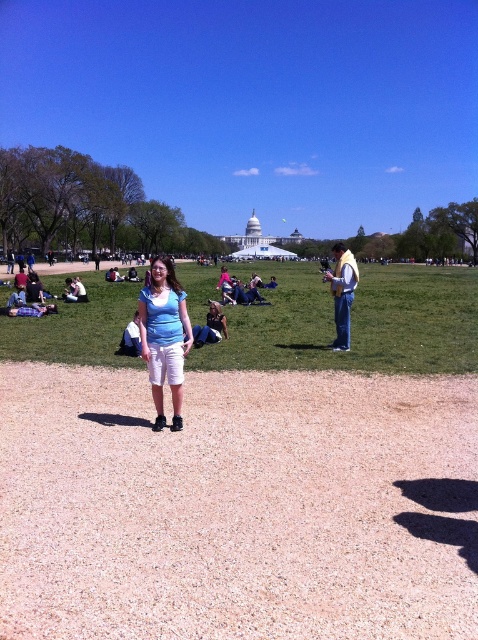
Can you confirm if matte blue shirt at center is thinner than yellow fabric scarf at right?

Indeed, matte blue shirt at center has a lesser width compared to yellow fabric scarf at right.

The height and width of the screenshot is (640, 478). What do you see at coordinates (164, 337) in the screenshot?
I see `matte blue shirt at center` at bounding box center [164, 337].

Between point (139, 300) and point (346, 312), which one is positioned in front?

Point (346, 312) is more forward.

The width and height of the screenshot is (478, 640). Find the location of `matte blue shirt at center`. matte blue shirt at center is located at coordinates (164, 337).

Can you confirm if brown gravel at center is positioned below matte blue shirt at center?

Indeed, brown gravel at center is positioned under matte blue shirt at center.

The width and height of the screenshot is (478, 640). I want to click on brown gravel at center, so click(x=237, y=506).

Who is more distant from viewer, (398, 516) or (173, 369)?

Point (173, 369)

Locate an element on the screen. brown gravel at center is located at coordinates (237, 506).

Which is in front, point (302, 342) or point (186, 332)?

Point (186, 332) is in front.

Locate an element on the screen. green grass at center is located at coordinates (356, 323).